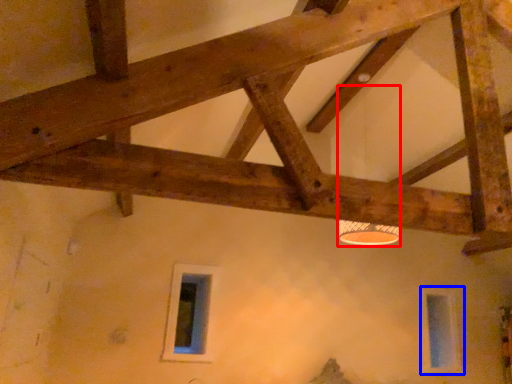
Question: Which of the following is the farthest to the observer, lamp (highlighted by a red box) or window (highlighted by a blue box)?

Choices:
 (A) lamp
 (B) window

Answer: (B)